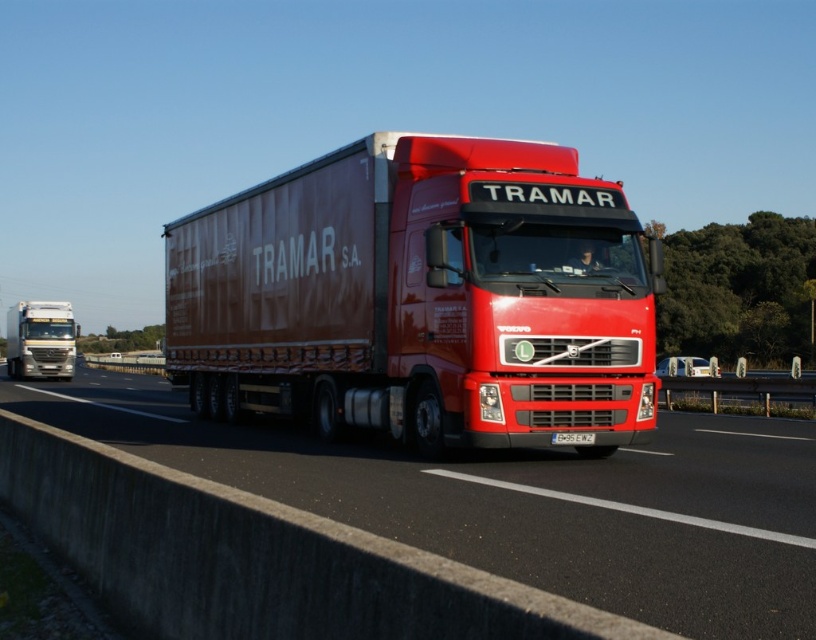
Question: Which of these objects is positioned closest to the red matte truck at center?

Choices:
 (A) metallic silver truck at left
 (B) white plastic license plate at center

Answer: (B)

Question: In this image, where is metallic red truck at center located relative to white plastic license plate at center?

Choices:
 (A) right
 (B) left

Answer: (B)

Question: Can you confirm if metallic red truck at center is positioned below metallic silver truck at left?

Choices:
 (A) no
 (B) yes

Answer: (A)

Question: Does metallic red truck at center appear over red matte truck at center?

Choices:
 (A) yes
 (B) no

Answer: (A)

Question: Which of the following is the farthest from the observer?

Choices:
 (A) (464, 460)
 (B) (533, 244)

Answer: (A)

Question: Which of the following is the farthest from the observer?

Choices:
 (A) metallic silver truck at left
 (B) metallic red truck at center
 (C) red matte truck at center
 (D) white plastic license plate at center

Answer: (A)